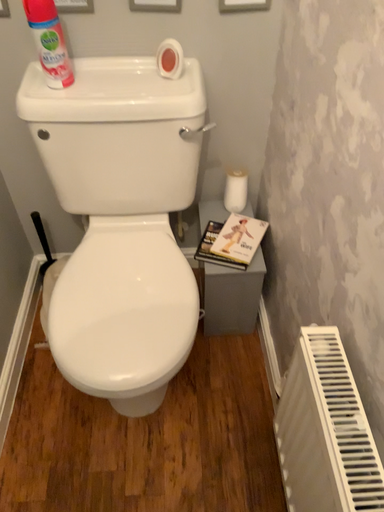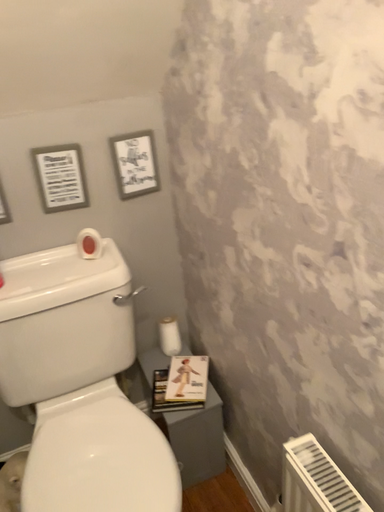
Question: Which way did the camera rotate in the video?

Choices:
 (A) rotated downward
 (B) rotated upward

Answer: (B)